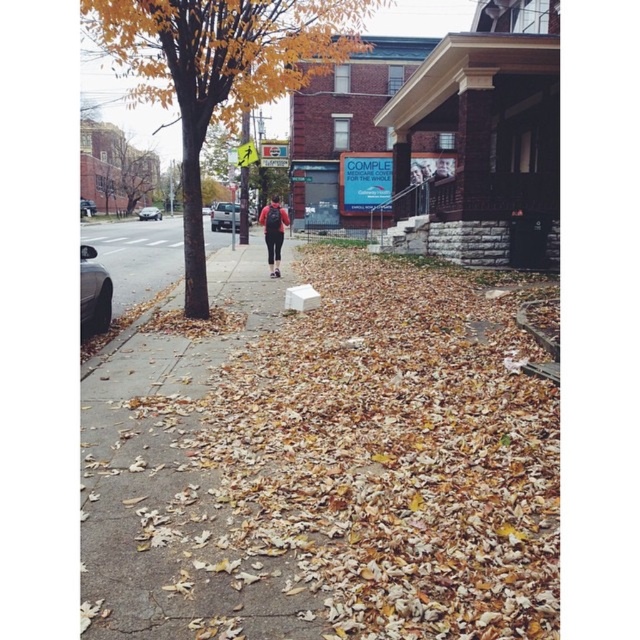
You are a photographer trying to capture a photo of the yellow leafy tree at center and the matte black backpack at center. Since you want to ensure both are clearly visible in the frame, which object should you focus on first to account for their sizes?

The yellow leafy tree at center is taller than the matte black backpack at center, so you should focus on the yellow leafy tree at center first as it is larger and requires more attention to ensure clarity.

From the picture: You are a photographer trying to capture both the yellow leafy tree at center and the matte black backpack at center in your shot. Since you want to emphasize the tree, should you use a wide or telephoto lens?

The yellow leafy tree at center is larger in size than the matte black backpack at center. To emphasize the tree, use a wide lens to make the tree appear even larger compared to the backpack.